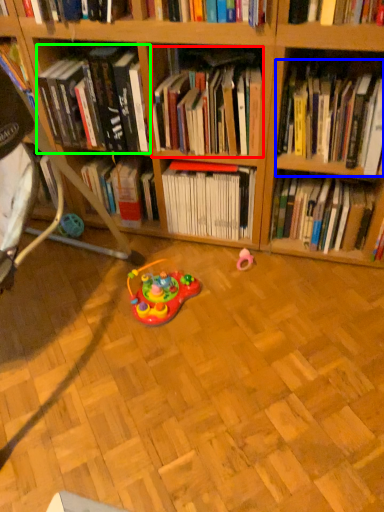
Question: Which object is the farthest from book (highlighted by a red box)? Choose among these: book (highlighted by a blue box) or book (highlighted by a green box).

Choices:
 (A) book
 (B) book

Answer: (A)